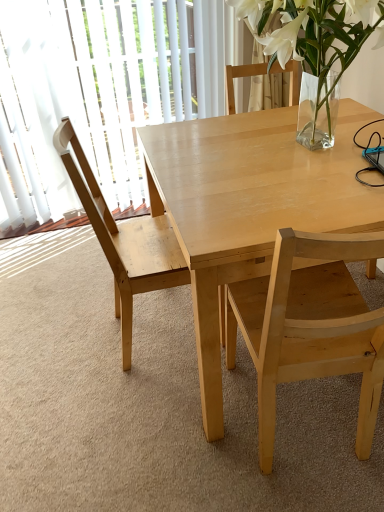
This screenshot has height=512, width=384. I want to click on vacant area to the left of light wood chair at center, placed as the first chair when sorted from right to left, so click(x=167, y=440).